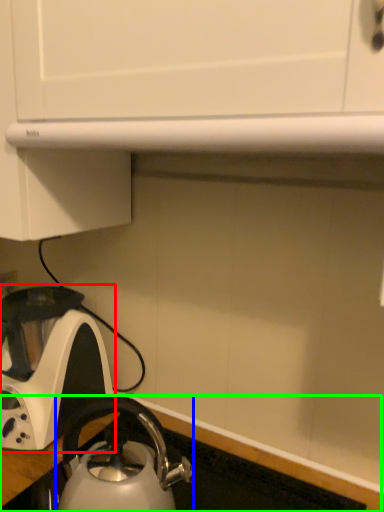
Question: Considering the real-world distances, which object is farthest from kettle (highlighted by a red box)? kettle (highlighted by a blue box) or counter top (highlighted by a green box)?

Choices:
 (A) kettle
 (B) counter top

Answer: (B)